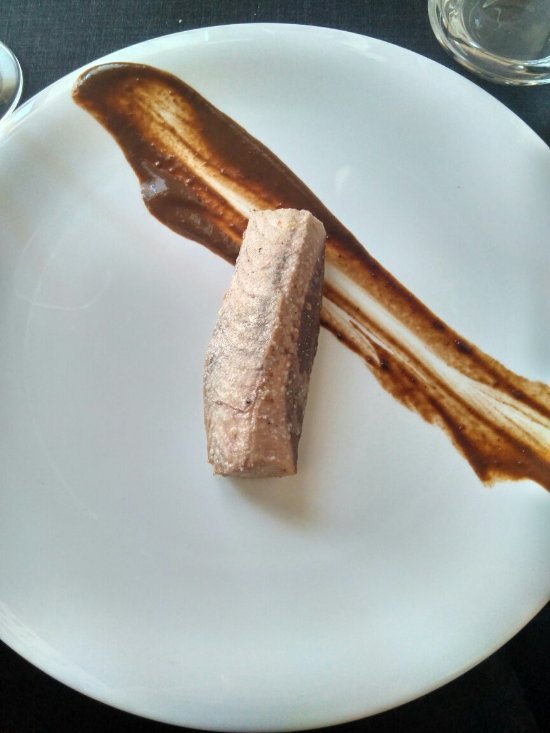
You are a GUI agent. You are given a task and a screenshot of the screen. Output one action in this format:
    pyautogui.click(x=<x>, y=<y>)
    Task: Click on the plate
    
    Given the screenshot: What is the action you would take?
    pyautogui.click(x=282, y=643)